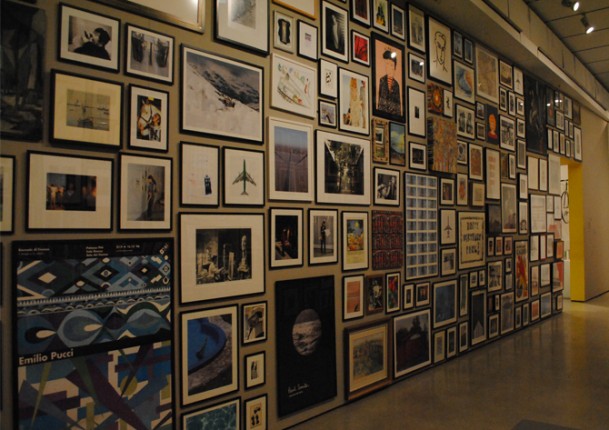
You are a GUI agent. You are given a task and a screenshot of the screen. Output one action in this format:
    pyautogui.click(x=<x>, y=<y>)
    Task: Click on the ceiling
    This screenshot has height=430, width=609.
    Given the screenshot: What is the action you would take?
    pyautogui.click(x=579, y=25)